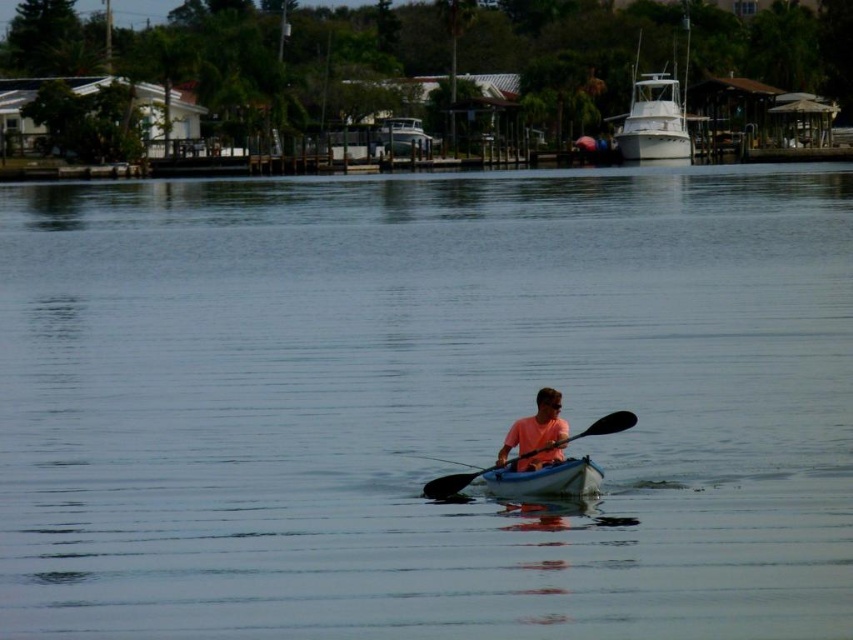
Question: Is clear water at center smaller than white glossy boat at upper center?

Choices:
 (A) no
 (B) yes

Answer: (A)

Question: Does clear water at center have a lesser width compared to black rubber paddle at center?

Choices:
 (A) yes
 (B) no

Answer: (B)

Question: Observing the image, what is the correct spatial positioning of clear water at center in reference to white glossy boat at upper center?

Choices:
 (A) right
 (B) left

Answer: (B)

Question: Estimate the real-world distances between objects in this image. Which object is closer to the black rubber paddle at center?

Choices:
 (A) clear water at center
 (B) pink matte kayak at center
 (C) white plastic canoe at center

Answer: (C)

Question: Which point is closer to the camera taking this photo?

Choices:
 (A) (500, 484)
 (B) (524, 458)
 (C) (653, 124)

Answer: (B)

Question: Among these objects, which one is nearest to the camera?

Choices:
 (A) white plastic canoe at center
 (B) pink matte kayak at center
 (C) black rubber paddle at center

Answer: (A)